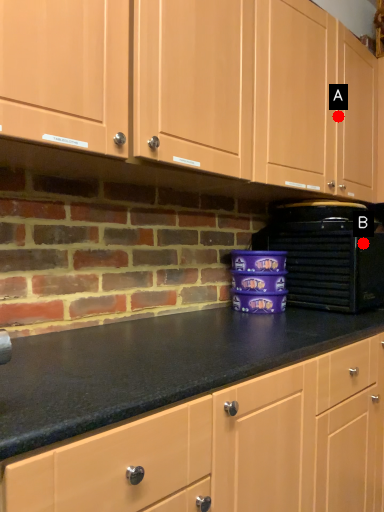
Question: Two points are circled on the image, labeled by A and B beside each circle. Which point is farther from the camera taking this photo?

Choices:
 (A) A is further
 (B) B is further

Answer: (A)